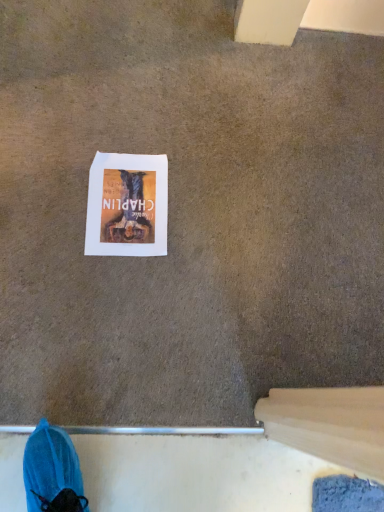
Locate an element on the screen. This screenshot has width=384, height=512. unoccupied region to the right of white paper at center is located at coordinates click(205, 231).